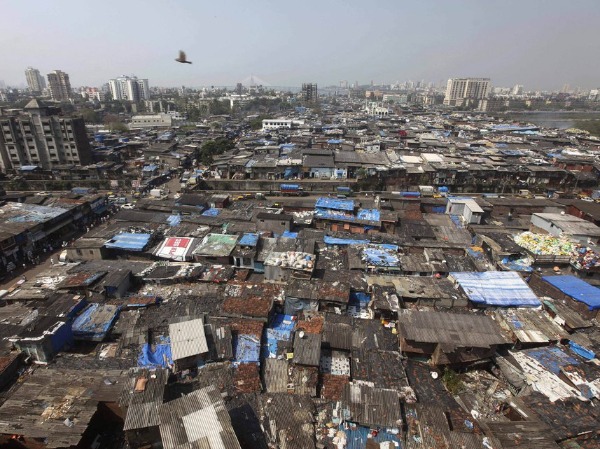
Find the location of a particular element. The image size is (600, 449). window is located at coordinates (30, 140).